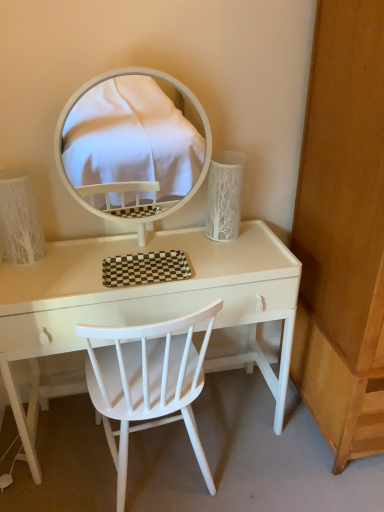
The height and width of the screenshot is (512, 384). Identify the location of vacant area that lies in front of white textured lampshade at left, marked as the first table lamp in a left-to-right arrangement. (32, 280).